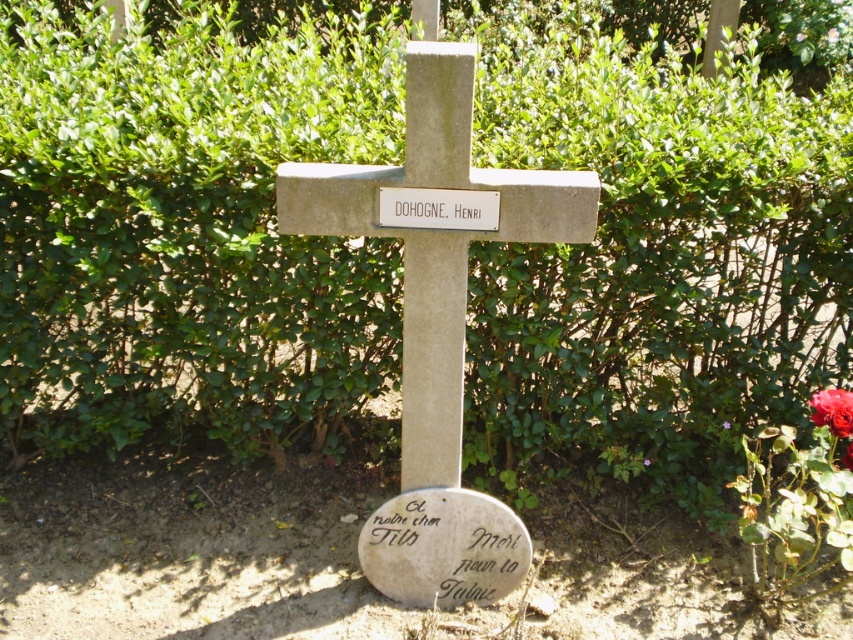
Image resolution: width=853 pixels, height=640 pixels. Identify the location of smooth stone cross at center. (438, 330).

Can you confirm if smooth stone cross at center is positioned below red matte rose at lower right?

Actually, smooth stone cross at center is above red matte rose at lower right.

Is point (419, 232) farther from camera compared to point (727, 428)?

That is False.

Find the location of a particular element. smooth stone cross at center is located at coordinates (438, 330).

Is white stone plaque at center behind red rose at center right?

No, it is not.

Identify the location of white stone plaque at center. (438, 209).

Is point (476, 220) closer to camera compared to point (648, 464)?

Yes, point (476, 220) is closer to viewer.

The height and width of the screenshot is (640, 853). What do you see at coordinates (438, 209) in the screenshot? I see `white stone plaque at center` at bounding box center [438, 209].

Does point (405, 198) lie in front of point (642, 461)?

Yes.

The height and width of the screenshot is (640, 853). I want to click on white stone plaque at center, so click(438, 209).